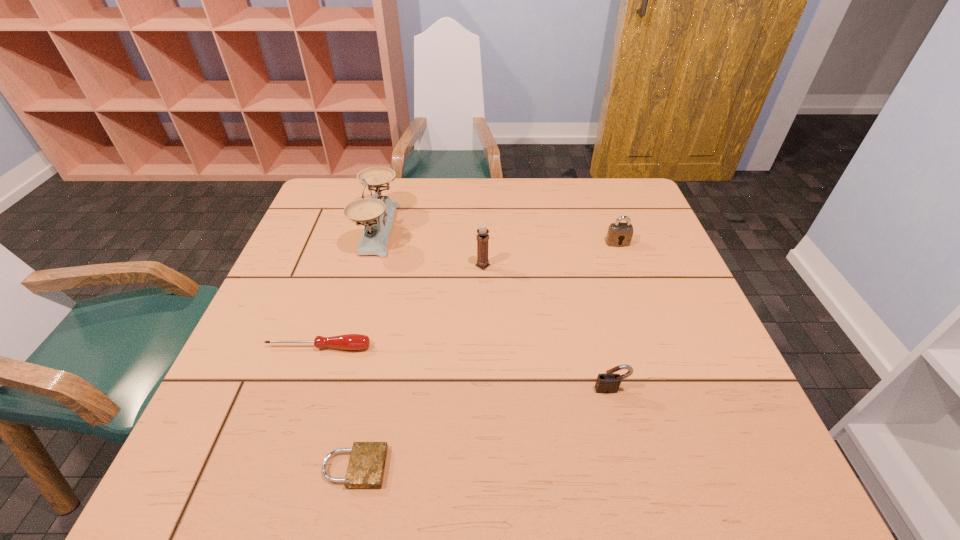
Select which padlock appears as the second closest to the third nearest object. Please provide its 2D coordinates. Your answer should be formatted as a tuple, i.e. [(x, y)], where the tuple contains the x and y coordinates of a point satisfying the conditions above.

[(607, 383)]

Locate an element on the screen. free space that satisfies the following two spatial constraints: 1. with the keyhole on the front of the second nearest padlock; 2. on the keyhole side of the nearest object is located at coordinates (630, 467).

At what (x,y) coordinates should I click in order to perform the action: click on free spot that satisfies the following two spatial constraints: 1. at the front of the rightmost padlock near the keyhole; 2. on the keyhole side of the nearest object. Please return your answer as a coordinate pair (x, y). Looking at the image, I should click on (699, 467).

Identify the location of free spot that satisfies the following two spatial constraints: 1. on the back side of the fourth object from left to right; 2. on the right side of the screwdriver. The image size is (960, 540). (346, 266).